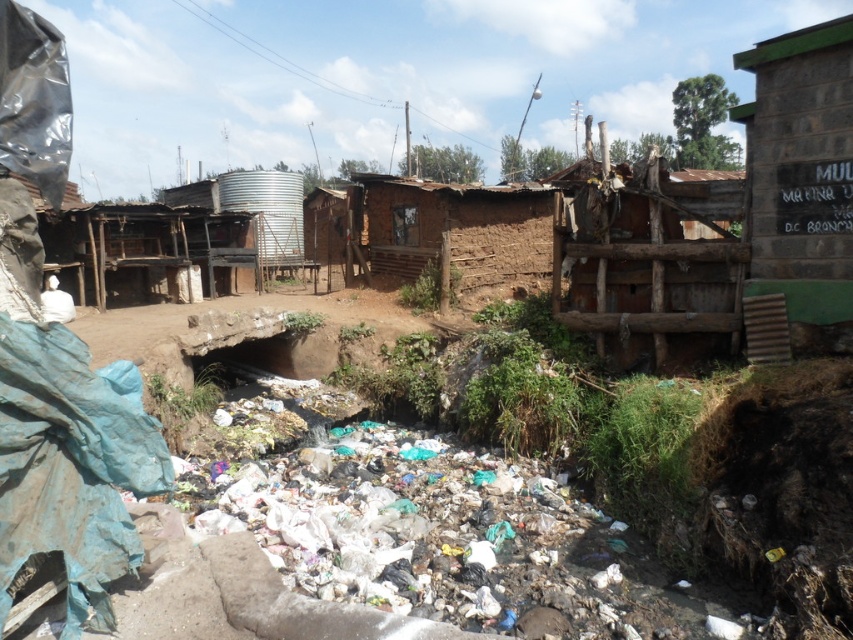
Based on the photo, you are standing in the middle of the scene and want to walk towards the green painted mud hut at right. Which direction should you go from the brown wooden hut at center?

The green painted mud hut at right is to the right of the brown wooden hut at center, so you should go to the right from the brown wooden hut at center to reach it.

You are standing at the point with coordinates point (80, 289) and want to go to the point (788, 250). Which direction should you move in?

You should move forward because point (788, 250) is in front of point (80, 289).